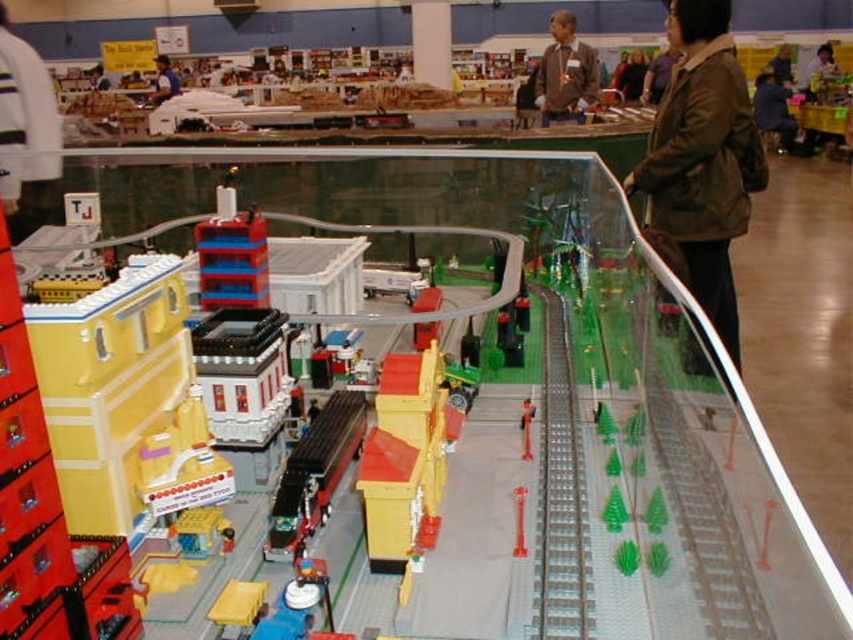
Find the location of a particular element. This screenshot has width=853, height=640. silver metallic train track at center is located at coordinates click(560, 490).

Who is positioned more to the right, silver metallic train track at center or metallic red train at center?

From the viewer's perspective, silver metallic train track at center appears more on the right side.

Describe the element at coordinates (560, 490) in the screenshot. I see `silver metallic train track at center` at that location.

You are a GUI agent. You are given a task and a screenshot of the screen. Output one action in this format:
    pyautogui.click(x=<x>, y=<y>)
    Task: Click on the silver metallic train track at center
    Image resolution: width=853 pixels, height=640 pixels.
    Given the screenshot: What is the action you would take?
    tap(560, 490)

Is brown matte jacket at upper right closer to camera compared to white fabric jacket at upper center?

Yes, brown matte jacket at upper right is closer to the viewer.

Does point (712, 218) come in front of point (20, 180)?

That is True.

Is point (712, 284) positioned behind point (4, 40)?

That is False.

I want to click on brown matte jacket at upper right, so click(x=701, y=161).

Is silver metallic train track at center wider than blue shirt at upper left?

In fact, silver metallic train track at center might be narrower than blue shirt at upper left.

Is point (570, 412) farther from camera compared to point (173, 88)?

No.

Identify the location of silver metallic train track at center. (560, 490).

Image resolution: width=853 pixels, height=640 pixels. I want to click on silver metallic train track at center, so click(560, 490).